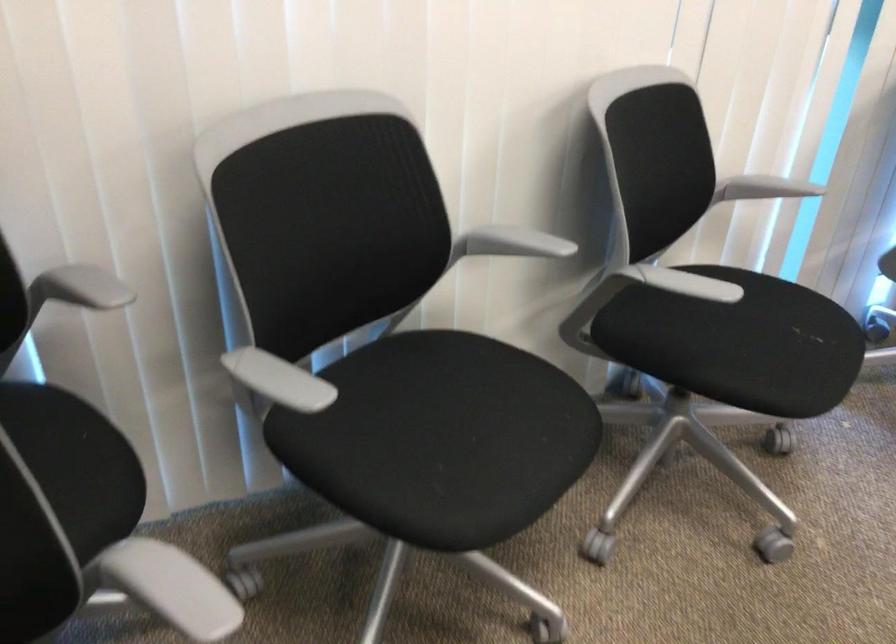
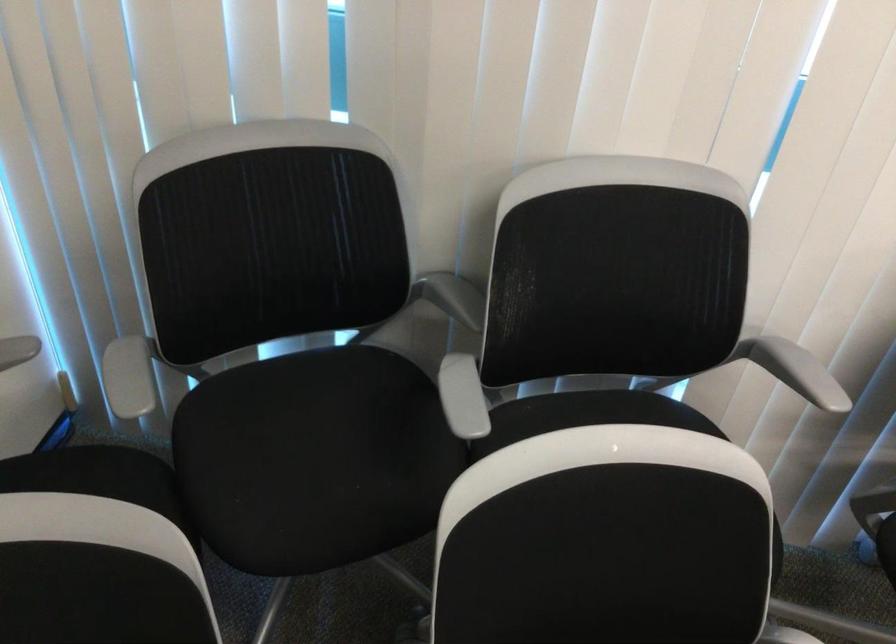
Question: How did the camera likely rotate?

Choices:
 (A) Left
 (B) Right
 (C) Up
 (D) Down

Answer: (A)